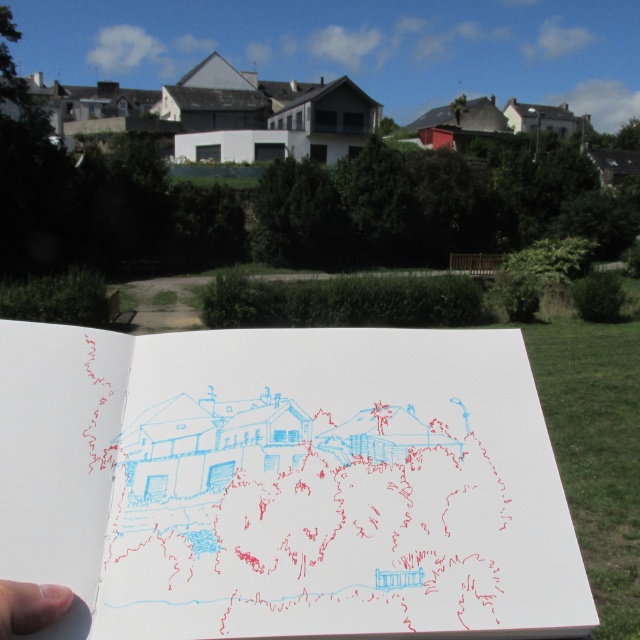
Between white paper at center and skinny flesh at lower left, which one has more height?

With more height is white paper at center.

Can you confirm if white paper at center is positioned above skinny flesh at lower left?

Yes.

Locate an element on the screen. This screenshot has height=640, width=640. white paper at center is located at coordinates (284, 483).